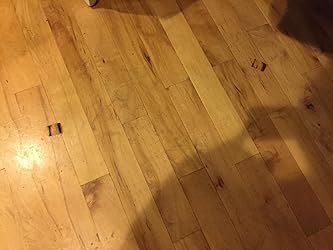
Locate an element on the screen. This screenshot has width=333, height=250. chair or table let is located at coordinates (91, 3).